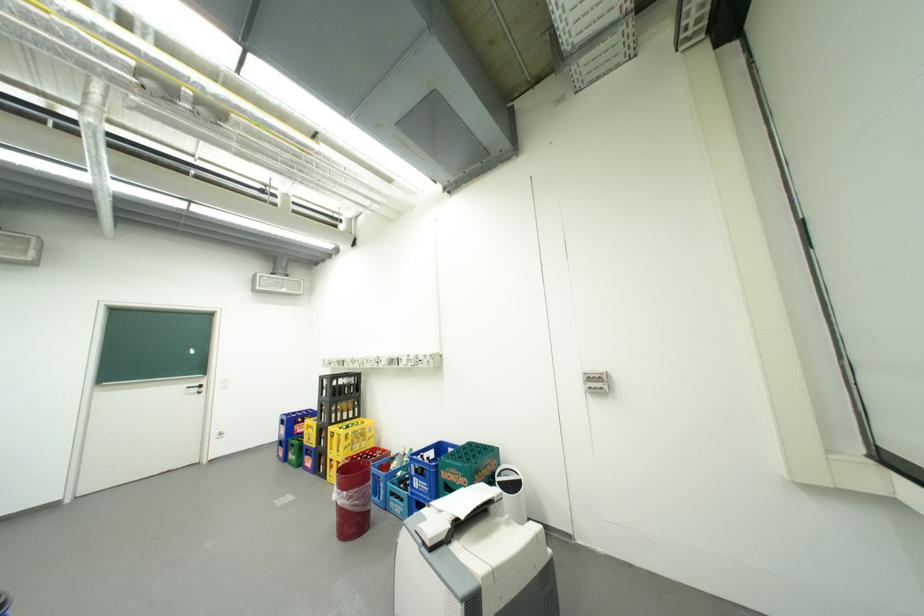
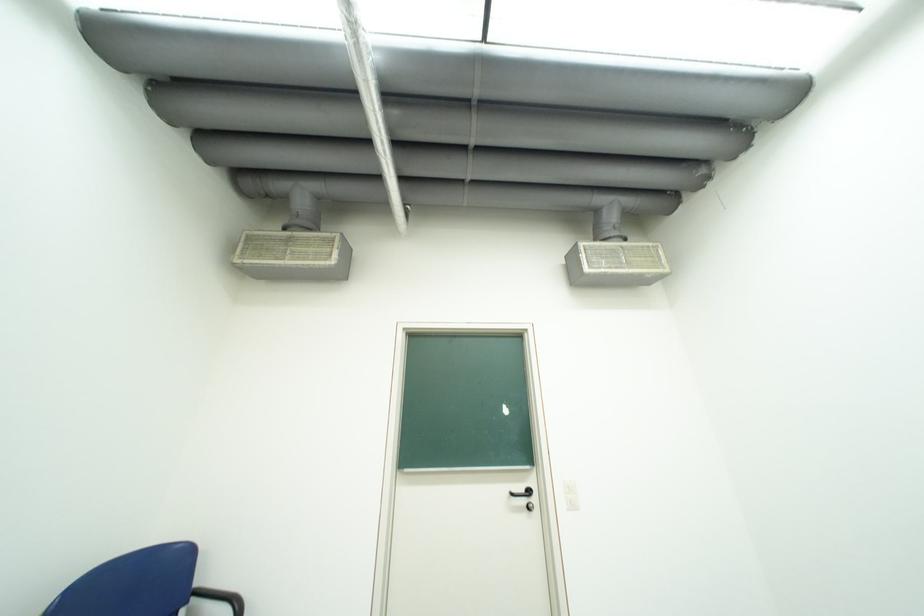
In the second image, find the point that corresponds to (199,389) in the first image.

(523, 495)